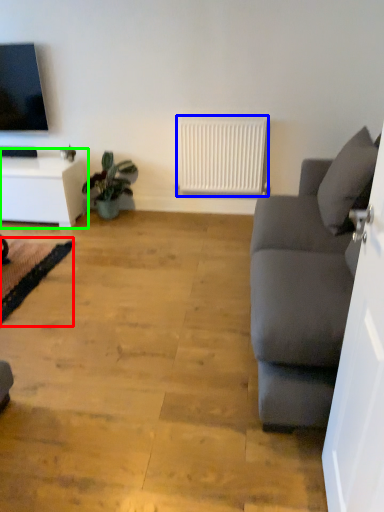
Question: Considering the real-world distances, which object is closest to yoga mat (highlighted by a red box)? radiator (highlighted by a blue box) or table (highlighted by a green box).

Choices:
 (A) radiator
 (B) table

Answer: (B)